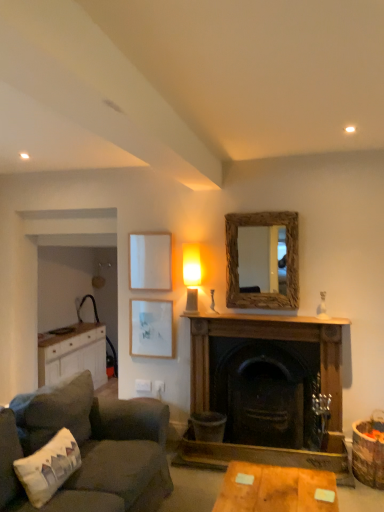
Question: From the image's perspective, is white wood cabinet at left positioned above or below white fabric pillow at lower left?

Choices:
 (A) below
 (B) above

Answer: (A)

Question: Is white wood cabinet at left wider or thinner than white fabric pillow at lower left?

Choices:
 (A) wide
 (B) thin

Answer: (A)

Question: Estimate the real-world distances between objects in this image. Which object is closer to the matte white picture frame at upper left, which is the second picture frame from top to bottom?

Choices:
 (A) white matte picture frame at upper left, the 2th picture frame ordered from the bottom
 (B) wooden table at lower center
 (C) wooden fireplace at center
 (D) rustic wood mirror at upper center
 (E) matte glass lamp at center

Answer: (A)

Question: Which object is the closest to the wooden table at lower center?

Choices:
 (A) wooden mantelpiece at center
 (B) dark green fabric couch at lower left
 (C) rustic wood mirror at upper center
 (D) white matte picture frame at upper left, which ranks as the 1th picture frame in top-to-bottom order
 (E) white wood cabinet at left

Answer: (B)